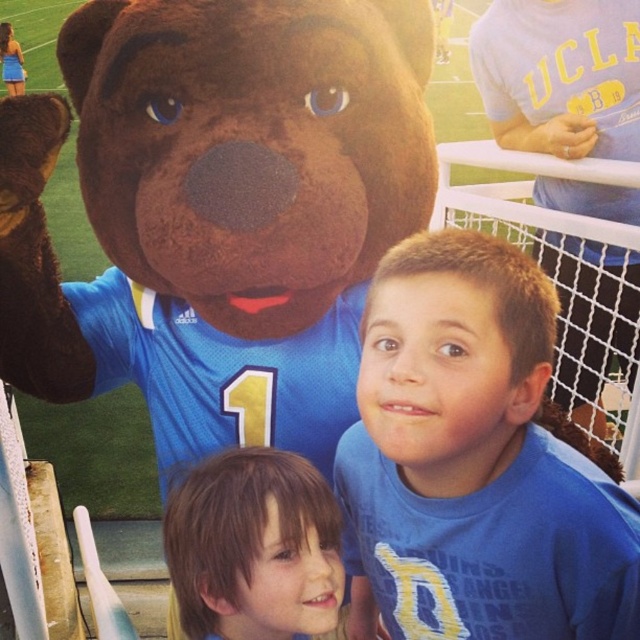
Is blue jersey at center in front of brown hair at center?

Yes.

Is point (580, 532) farther from viewer compared to point (257, 509)?

That is False.

Who is more forward, (445, 499) or (294, 554)?

Point (294, 554)

At what (x,y) coordinates should I click in order to perform the action: click on blue jersey at center. Please return your answer as a coordinate pair (x, y). Looking at the image, I should click on (474, 461).